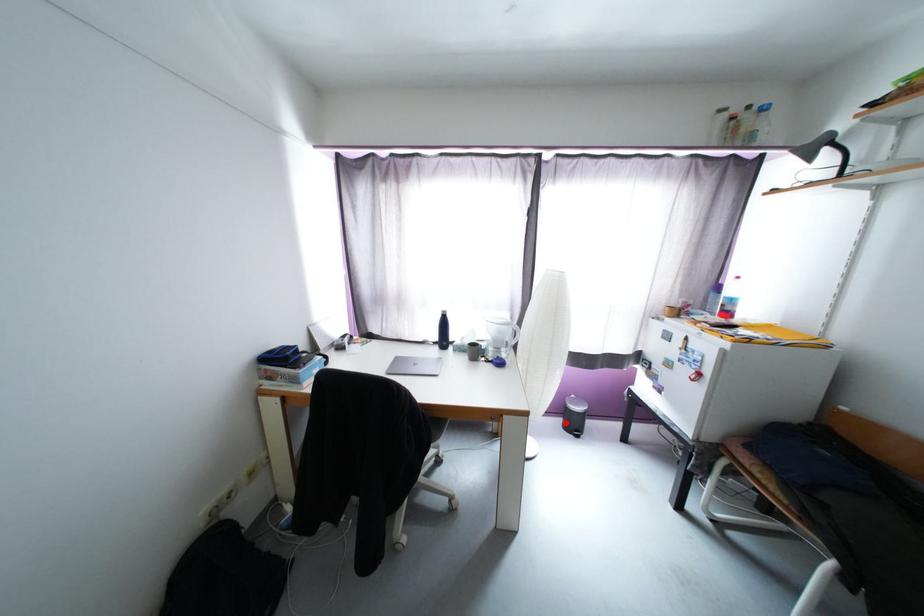
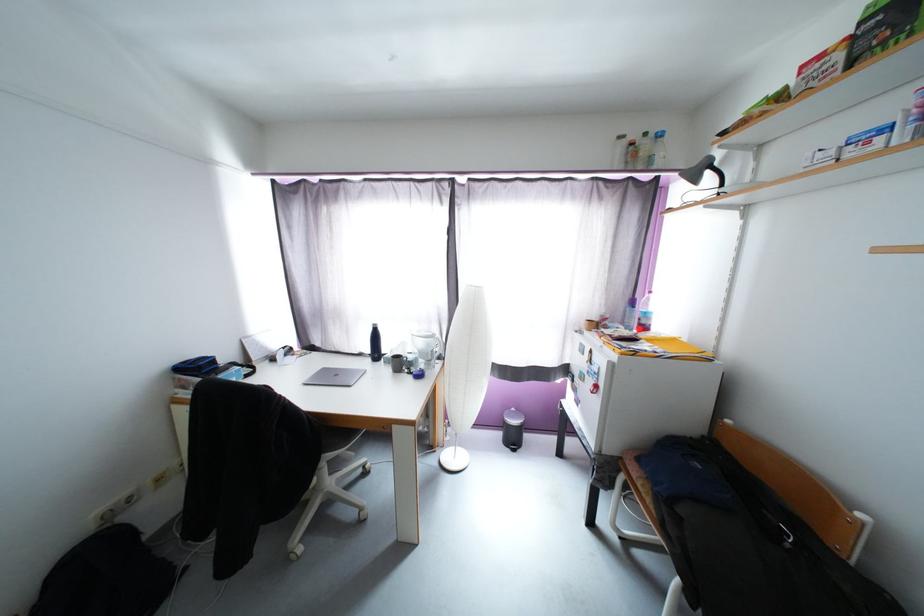
Where in the second image is the point corresponding to the highlighted location from the first image?

(505, 437)